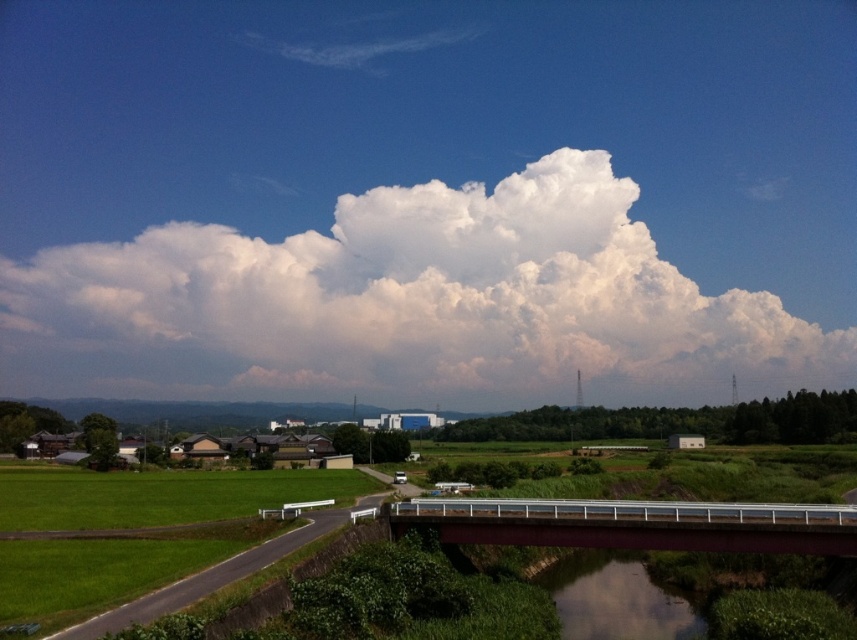
You are a hiker standing on the green grass at lower left and want to cross the metallic gray bridge at center. Can you see the bridge from your current position?

The green grass at lower left is behind metallic gray bridge at center, so you cannot see the bridge from your current position on the green grass at lower left.

You are a bird soaring above the rural landscape. You want to land on the metallic gray bridge at center to rest. However, there is a white fluffy cloud at upper center above it. Do you think the cloud will block your path to the bridge?

The white fluffy cloud at upper center is positioned over the metallic gray bridge at center, so it might block your path to the bridge.